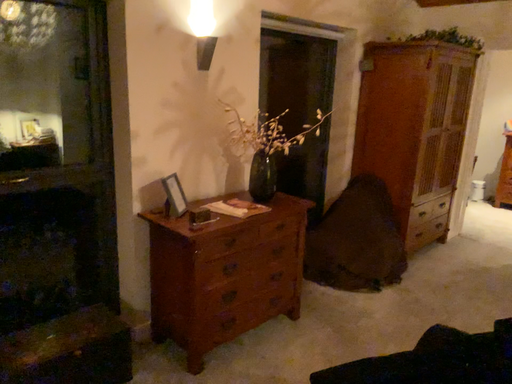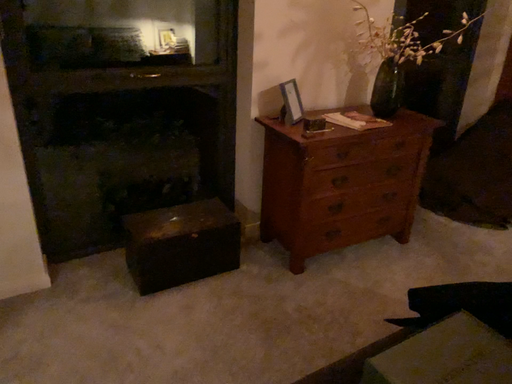
Question: Which way did the camera rotate in the video?

Choices:
 (A) rotated upward
 (B) rotated downward

Answer: (B)